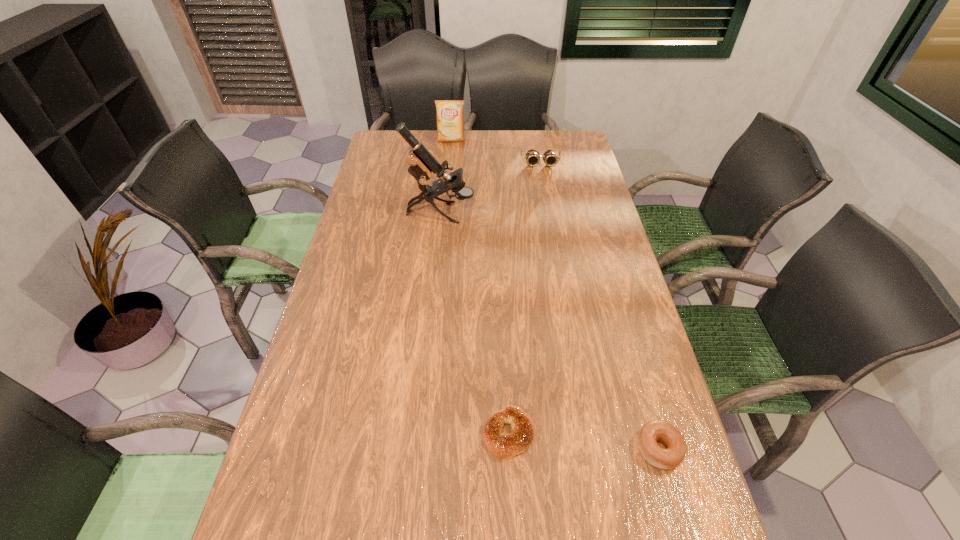
In order to click on the third nearest object in this screenshot , I will do `click(422, 163)`.

This screenshot has height=540, width=960. What are the coordinates of `microscope` in the screenshot? It's located at (422, 163).

Where is `the farthest object`? the farthest object is located at coordinates (450, 120).

The width and height of the screenshot is (960, 540). I want to click on crisp (potato chip), so click(450, 120).

Find the location of a particular element. goggles is located at coordinates (550, 158).

At what (x,y) coordinates should I click in order to perform the action: click on the second object from right to left. Please return your answer as a coordinate pair (x, y). Looking at the image, I should click on (550, 158).

At what (x,y) coordinates should I click in order to perform the action: click on the right bagel. Please return your answer as a coordinate pair (x, y). The height and width of the screenshot is (540, 960). Looking at the image, I should click on (654, 431).

At what (x,y) coordinates should I click in order to perform the action: click on the fourth tallest object. Please return your answer as a coordinate pair (x, y). This screenshot has width=960, height=540. Looking at the image, I should click on (654, 431).

Locate an element on the screen. The image size is (960, 540). the third object from right to left is located at coordinates (507, 446).

The height and width of the screenshot is (540, 960). What are the coordinates of `the shortest object` in the screenshot? It's located at (507, 446).